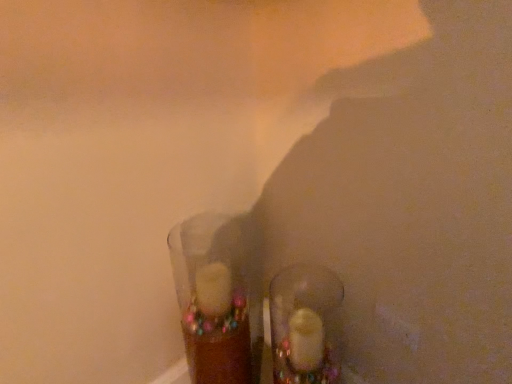
Question: Is translucent glass shoe at center spatially inside translucent glass candle at center, or outside of it?

Choices:
 (A) outside
 (B) inside

Answer: (A)

Question: Considering the positions of translucent glass shoe at center and translucent glass candle at center in the image, is translucent glass shoe at center taller or shorter than translucent glass candle at center?

Choices:
 (A) tall
 (B) short

Answer: (B)

Question: In the image, is translucent glass shoe at center positioned in front of or behind translucent glass candle at center?

Choices:
 (A) behind
 (B) front

Answer: (A)

Question: Would you say translucent glass candle at center is inside or outside translucent glass shoe at center?

Choices:
 (A) outside
 (B) inside

Answer: (A)

Question: Is translucent glass candle at center bigger or smaller than translucent glass shoe at center?

Choices:
 (A) small
 (B) big

Answer: (B)

Question: From a real-world perspective, relative to translucent glass shoe at center, is translucent glass candle at center vertically above or below?

Choices:
 (A) below
 (B) above

Answer: (B)

Question: In terms of height, does translucent glass candle at center look taller or shorter compared to translucent glass shoe at center?

Choices:
 (A) tall
 (B) short

Answer: (A)